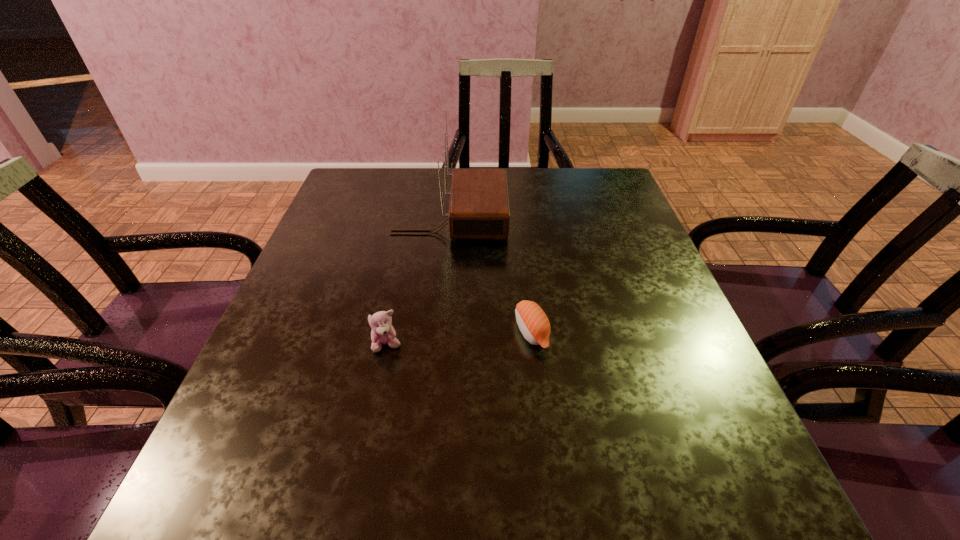
Where is `blank space that satisfies the following two spatial constraints: 1. on the front panel of the tallest object; 2. at the face of the second tallest object`? The image size is (960, 540). blank space that satisfies the following two spatial constraints: 1. on the front panel of the tallest object; 2. at the face of the second tallest object is located at coordinates (439, 345).

What are the coordinates of `blank space that satisfies the following two spatial constraints: 1. on the front panel of the sushi; 2. on the left side of the radio_receiver` in the screenshot? It's located at (441, 332).

The width and height of the screenshot is (960, 540). I want to click on free space that satisfies the following two spatial constraints: 1. on the front panel of the radio_receiver; 2. at the face of the second tallest object, so click(x=439, y=345).

Where is `vacant area in the image that satisfies the following two spatial constraints: 1. on the front panel of the farthest object; 2. at the face of the teddy bear`? The width and height of the screenshot is (960, 540). vacant area in the image that satisfies the following two spatial constraints: 1. on the front panel of the farthest object; 2. at the face of the teddy bear is located at coordinates (439, 345).

The width and height of the screenshot is (960, 540). Find the location of `vacant region that satisfies the following two spatial constraints: 1. on the front panel of the tallest object; 2. at the face of the teddy bear`. vacant region that satisfies the following two spatial constraints: 1. on the front panel of the tallest object; 2. at the face of the teddy bear is located at coordinates (439, 345).